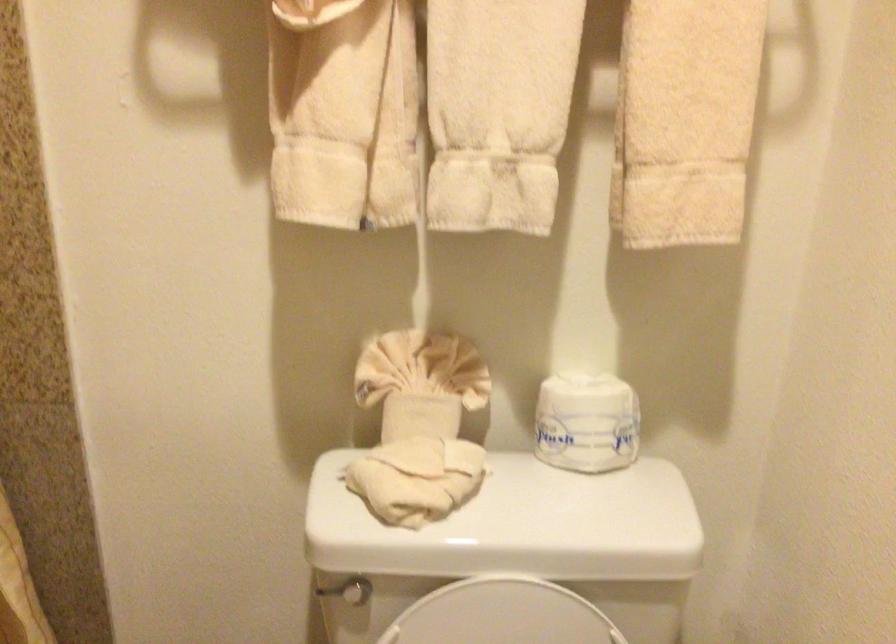
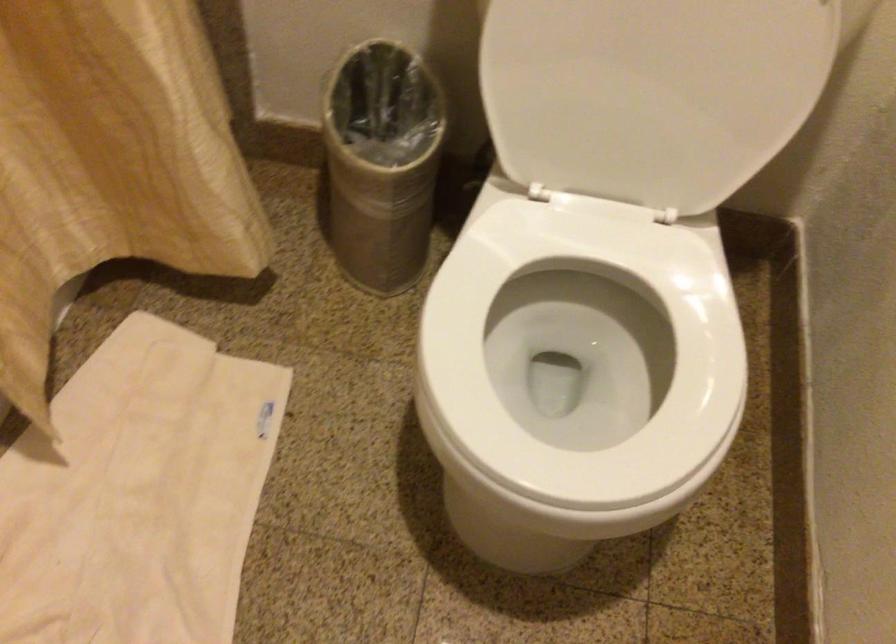
Question: The first image is from the beginning of the video and the second image is from the end. How did the camera likely rotate when shooting the video?

Choices:
 (A) Left
 (B) Right
 (C) Up
 (D) Down

Answer: (D)